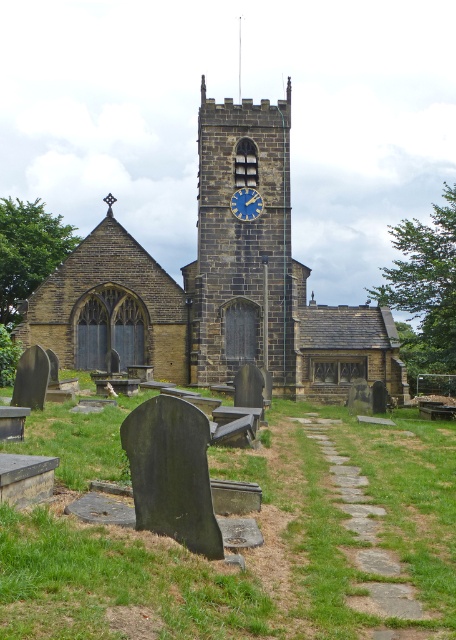
The image size is (456, 640). What do you see at coordinates (243, 244) in the screenshot?
I see `stone clock tower at center` at bounding box center [243, 244].

Does stone clock tower at center have a greater height compared to blue painted clock face at center?

Yes.

What do you see at coordinates (243, 244) in the screenshot? The width and height of the screenshot is (456, 640). I see `stone clock tower at center` at bounding box center [243, 244].

The width and height of the screenshot is (456, 640). I want to click on stone clock tower at center, so click(243, 244).

Does brown stone church at center have a smaller size compared to stone clock tower at center?

Actually, brown stone church at center might be larger than stone clock tower at center.

Which is in front, point (188, 268) or point (224, 275)?

Point (224, 275) is more forward.

Find the location of a particular element. This screenshot has width=456, height=640. brown stone church at center is located at coordinates (216, 284).

Which is behind, point (271, 157) or point (238, 209)?

The point (271, 157) is more distant.

Does brown stone church at center have a smaller size compared to blue painted clock face at center?

Actually, brown stone church at center might be larger than blue painted clock face at center.

Does point (236, 257) lie in front of point (259, 214)?

That is True.

Identify the location of brown stone church at center. (216, 284).